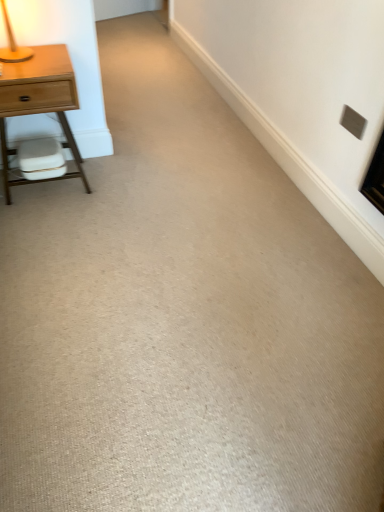
Question: Is gray matte electric outlet at upper right at the left side of white matte swivel chair at left?

Choices:
 (A) no
 (B) yes

Answer: (A)

Question: Can you confirm if gray matte electric outlet at upper right is taller than white matte swivel chair at left?

Choices:
 (A) no
 (B) yes

Answer: (A)

Question: Is gray matte electric outlet at upper right further to camera compared to white matte swivel chair at left?

Choices:
 (A) no
 (B) yes

Answer: (A)

Question: Is gray matte electric outlet at upper right facing towards white matte swivel chair at left?

Choices:
 (A) yes
 (B) no

Answer: (A)

Question: Considering the relative sizes of gray matte electric outlet at upper right and white matte swivel chair at left in the image provided, is gray matte electric outlet at upper right smaller than white matte swivel chair at left?

Choices:
 (A) yes
 (B) no

Answer: (A)

Question: Considering the positions of wooden table lamp at upper left and white matte swivel chair at left in the image, is wooden table lamp at upper left wider or thinner than white matte swivel chair at left?

Choices:
 (A) wide
 (B) thin

Answer: (A)

Question: Is wooden table lamp at upper left bigger or smaller than white matte swivel chair at left?

Choices:
 (A) small
 (B) big

Answer: (B)

Question: Is wooden table lamp at upper left taller or shorter than white matte swivel chair at left?

Choices:
 (A) tall
 (B) short

Answer: (A)

Question: Considering their positions, is wooden table lamp at upper left located in front of or behind white matte swivel chair at left?

Choices:
 (A) behind
 (B) front

Answer: (B)

Question: Is gray matte electric outlet at upper right wider or thinner than wooden table lamp at upper left?

Choices:
 (A) wide
 (B) thin

Answer: (B)

Question: From the image's perspective, relative to wooden table lamp at upper left, is gray matte electric outlet at upper right above or below?

Choices:
 (A) below
 (B) above

Answer: (A)

Question: In terms of size, does gray matte electric outlet at upper right appear bigger or smaller than wooden table lamp at upper left?

Choices:
 (A) big
 (B) small

Answer: (B)

Question: Considering the positions of gray matte electric outlet at upper right and wooden table lamp at upper left in the image, is gray matte electric outlet at upper right taller or shorter than wooden table lamp at upper left?

Choices:
 (A) short
 (B) tall

Answer: (A)

Question: Is white matte swivel chair at left taller or shorter than light wood/finish nightstand at left?

Choices:
 (A) tall
 (B) short

Answer: (B)

Question: Based on their sizes in the image, would you say white matte swivel chair at left is bigger or smaller than light wood/finish nightstand at left?

Choices:
 (A) small
 (B) big

Answer: (A)